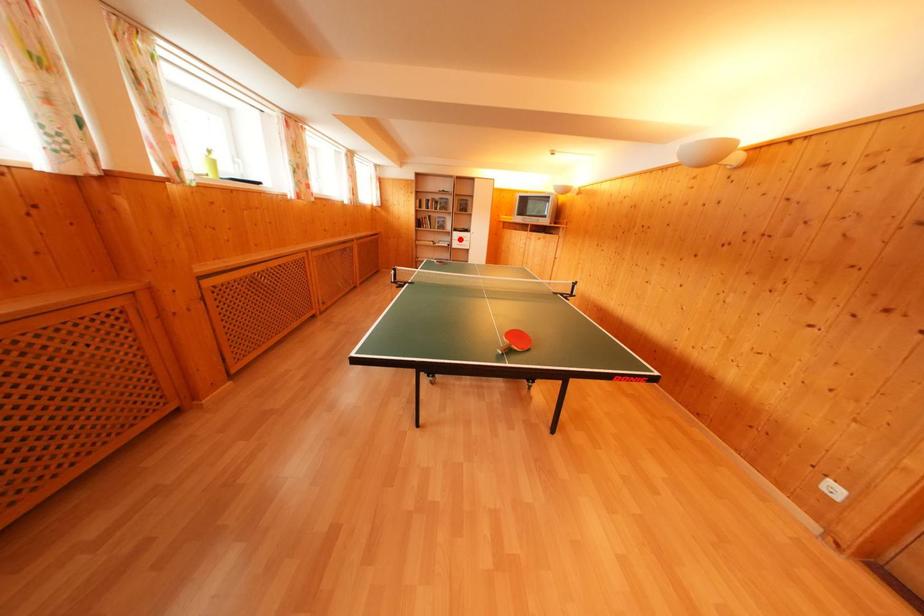
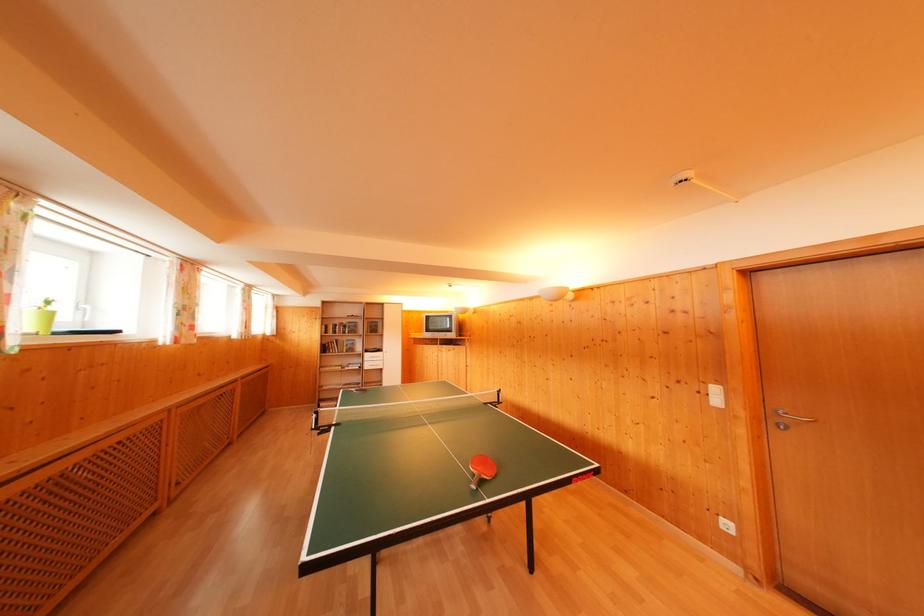
Question: I am providing you with two images of the same scene from different viewpoints. Given a red point in image1, look at the same physical point in image2. Is it:

Choices:
 (A) Closer to the viewpoint
 (B) Farther from the viewpoint

Answer: (B)